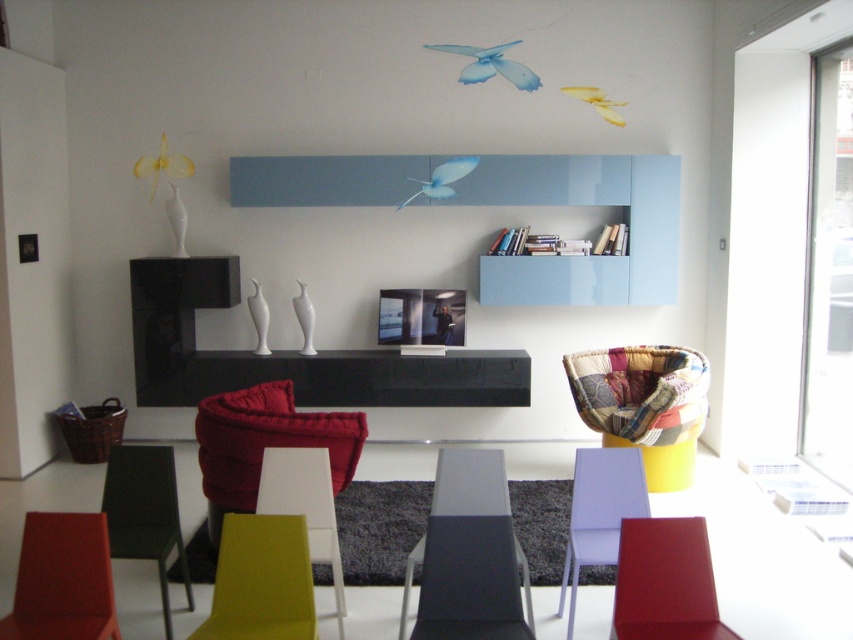
You are standing in the living room and want to reach the point marked at coordinates point (1, 624). If your walking speed is 3 feet per second, how many seconds will it take you to reach that point?

The distance between you and the point (1, 624) is 8.48 feet. At a speed of 3 feet per second, it will take approximately 2.83 seconds to reach the point.